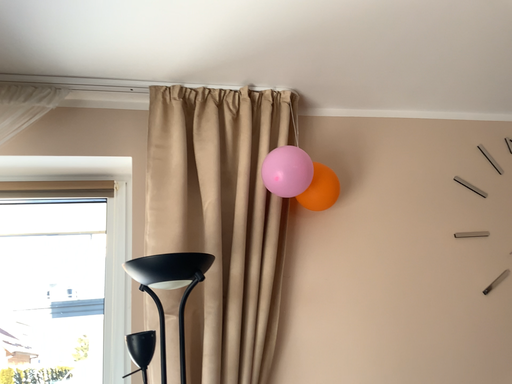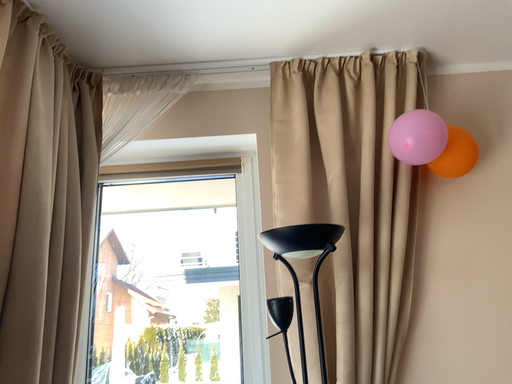
Question: How did the camera likely rotate when shooting the video?

Choices:
 (A) rotated left
 (B) rotated right

Answer: (A)